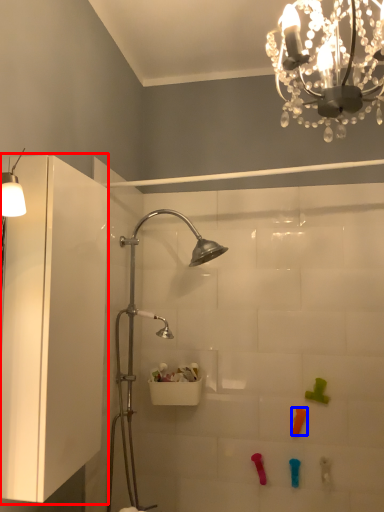
Question: Which object appears farthest to the camera in this image, glass door (highlighted by a red box) or toy (highlighted by a blue box)?

Choices:
 (A) glass door
 (B) toy

Answer: (B)